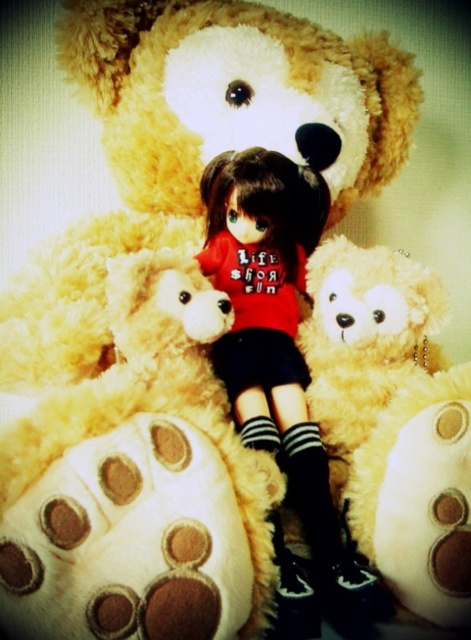
You are a toy organizer trying to stack the fluffy yellow teddy bear at center and the matte red shirt at center on a shelf. Based on their heights, which one should you place at the bottom to ensure stability?

The fluffy yellow teddy bear at center is not as tall as matte red shirt at center, so place the taller matte red shirt at center at the bottom for better stability.

You are a photographer trying to capture the perfect shot of the fluffy yellow teddy bear at center. Based on its position in the image, what coordinates should you aim your camera at to ensure the teddy bear is centered in the frame?

The fluffy yellow teddy bear at center is located at coordinates point (138,483), so you should aim your camera at those coordinates to center it in the frame.